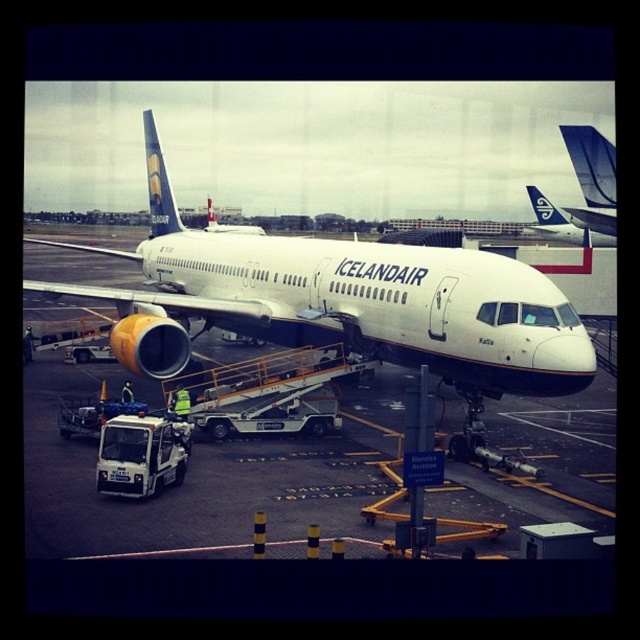
You are an airport staff member observing the scene. You need to determine which airplane is closer to you. Based on the sizes of the white matte airplane at center and the white matte airplane at upper center, which one is closer?

The white matte airplane at center is larger in size than the white matte airplane at upper center, so the white matte airplane at center is closer to you.